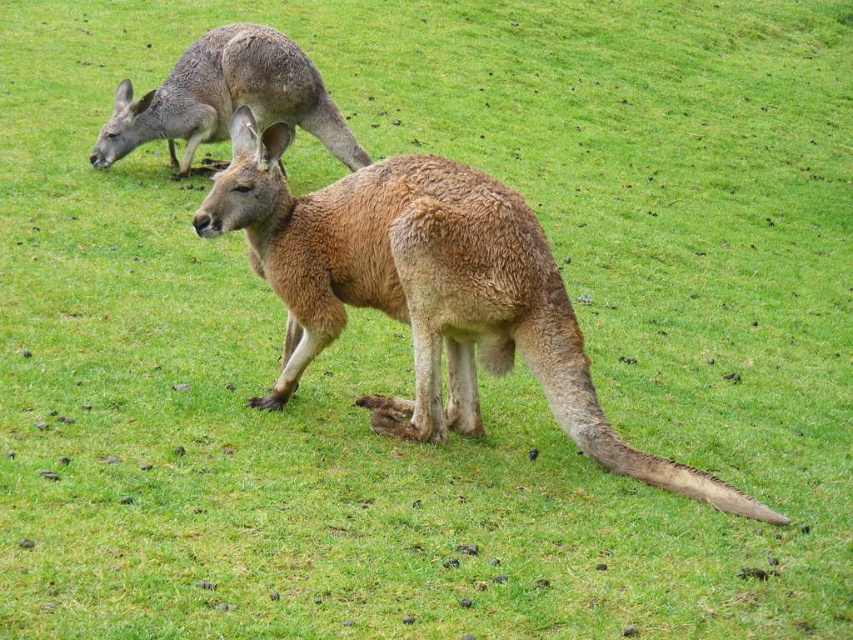
You are a photographer trying to capture both kangaroos in a single frame. The camera you are using has a zoom lens that can only focus on objects within a 100cm height range. Given that the brown furry kangaroo at center is much taller than the gray fur kangaroo at upper left, will you be able to include both in your photo without adjusting the focus?

The brown furry kangaroo at center is much taller than the gray fur kangaroo at upper left. Since the camera can only focus on objects within a 100cm height range, you need to ensure the height difference between them is less than or equal to 100cm. However, the exact height difference isn not provided, so it is uncertain if they can both be in focus without more information.

You are standing in the grassy field and see two points marked in the image. The first point is labeled as point (444,296) and the second is point (115,131). Which point is closer to you?

Point (444,296) is in front of point (115,131), so it is closer to you.